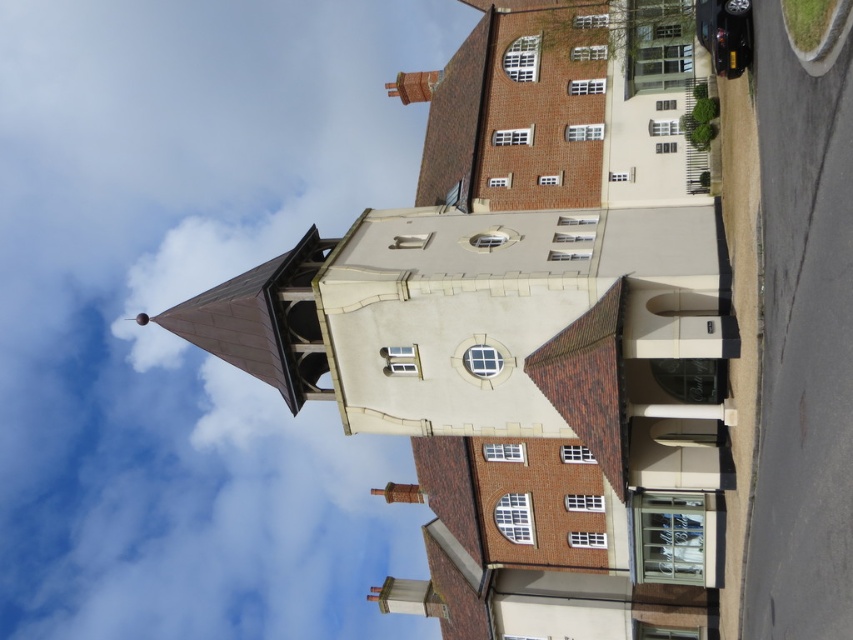
Question: Which point is closer to the camera?

Choices:
 (A) (480, 4)
 (B) (749, 4)

Answer: (B)

Question: Is brown tiled tower at center in front of metallic silver clock at center?

Choices:
 (A) yes
 (B) no

Answer: (B)

Question: Is brown tiled tower at center smaller than metallic silver clock at center?

Choices:
 (A) yes
 (B) no

Answer: (B)

Question: Which point is closer to the camera taking this photo?

Choices:
 (A) (737, 8)
 (B) (670, 109)

Answer: (A)

Question: Can you confirm if brown tiled tower at center is positioned to the left of metallic silver clock at center?

Choices:
 (A) yes
 (B) no

Answer: (A)